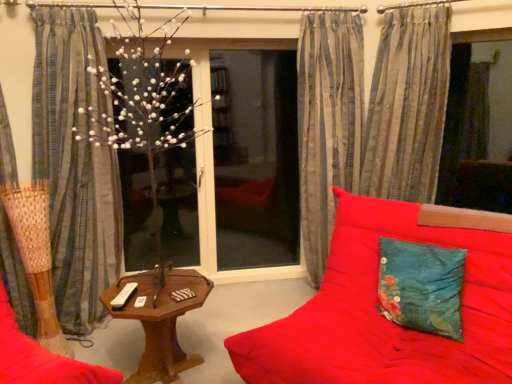
Question: Does striped fabric curtain at right, which appears as the 1th curtain when viewed from the right, have a lesser height compared to teal fabric cushion at right?

Choices:
 (A) yes
 (B) no

Answer: (B)

Question: Considering the relative positions of striped fabric curtain at right, which is the 4th curtain from left to right, and teal fabric cushion at right in the image provided, is striped fabric curtain at right, which is the 4th curtain from left to right, to the left of teal fabric cushion at right from the viewer's perspective?

Choices:
 (A) no
 (B) yes

Answer: (A)

Question: From a real-world perspective, is striped fabric curtain at right, which is the 4th curtain from left to right, positioned under teal fabric cushion at right based on gravity?

Choices:
 (A) yes
 (B) no

Answer: (B)

Question: Is striped fabric curtain at right, which is the 4th curtain from left to right, thinner than teal fabric cushion at right?

Choices:
 (A) no
 (B) yes

Answer: (A)

Question: Is striped fabric curtain at right, which appears as the 1th curtain when viewed from the right, positioned in front of teal fabric cushion at right?

Choices:
 (A) no
 (B) yes

Answer: (A)

Question: Considering the positions of point 274,322 and point 79,281, is point 274,322 closer or farther from the camera than point 79,281?

Choices:
 (A) closer
 (B) farther

Answer: (A)

Question: From the image's perspective, relative to striped fabric curtain at left, which is counted as the second curtain, starting from the left, is red fabric couch at center above or below?

Choices:
 (A) above
 (B) below

Answer: (B)

Question: Based on their positions, is red fabric couch at center located to the left or right of striped fabric curtain at left, which is counted as the second curtain, starting from the left?

Choices:
 (A) left
 (B) right

Answer: (B)

Question: In terms of width, does red fabric couch at center look wider or thinner when compared to striped fabric curtain at left, which is the 3th curtain from right to left?

Choices:
 (A) thin
 (B) wide

Answer: (B)

Question: From a real-world perspective, is striped fabric curtain at left, which is the 3th curtain from right to left, above or below woodenobject at center?

Choices:
 (A) below
 (B) above

Answer: (B)

Question: Considering the positions of point (32, 142) and point (166, 307), is point (32, 142) closer or farther from the camera than point (166, 307)?

Choices:
 (A) farther
 (B) closer

Answer: (A)

Question: In terms of width, does striped fabric curtain at left, which is counted as the second curtain, starting from the left, look wider or thinner when compared to woodenobject at center?

Choices:
 (A) thin
 (B) wide

Answer: (A)

Question: From their relative heights in the image, would you say striped fabric curtain at left, which is the 3th curtain from right to left, is taller or shorter than woodenobject at center?

Choices:
 (A) short
 (B) tall

Answer: (B)

Question: Is woodenobject at center inside or outside of red fabric couch at center?

Choices:
 (A) outside
 (B) inside

Answer: (A)

Question: Would you say woodenobject at center is to the left or to the right of red fabric couch at center in the picture?

Choices:
 (A) right
 (B) left

Answer: (B)